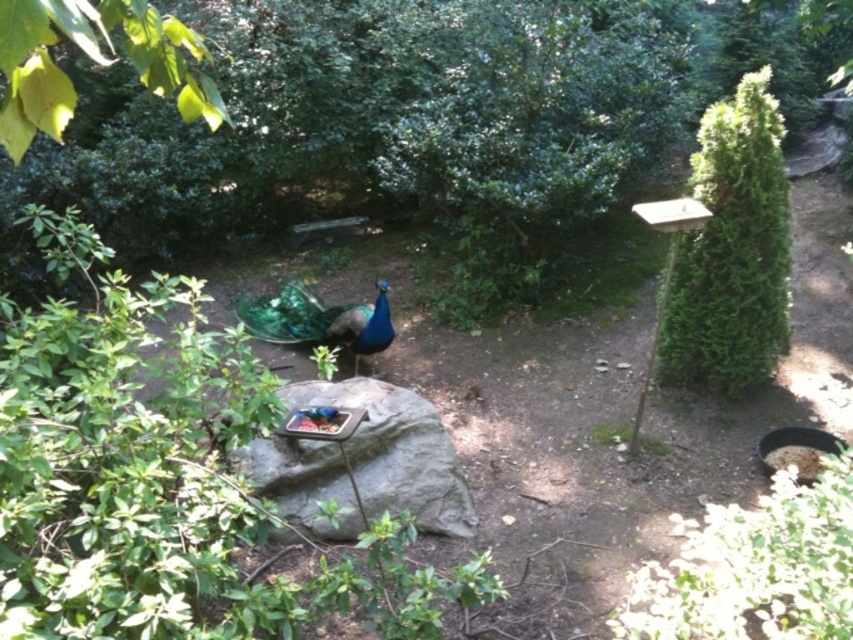
Consider the image. You are a gardener trying to determine which green leafy bush is smaller in size. You see the green leafy bush at right and the green leafy bush at lower right. Which one is smaller?

The green leafy bush at right is smaller in size because it occupies less space than the green leafy bush at lower right.